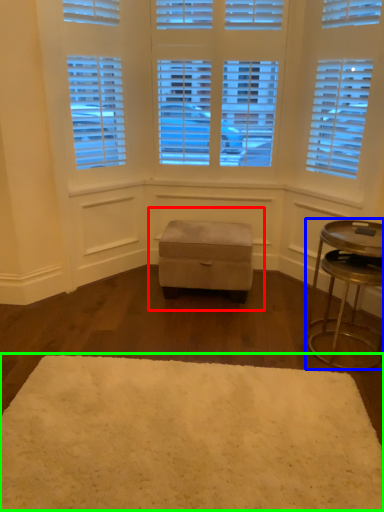
Question: Which object is the farthest from music stool (highlighted by a red box)? Choose among these: table (highlighted by a blue box) or mat (highlighted by a green box).

Choices:
 (A) table
 (B) mat

Answer: (B)